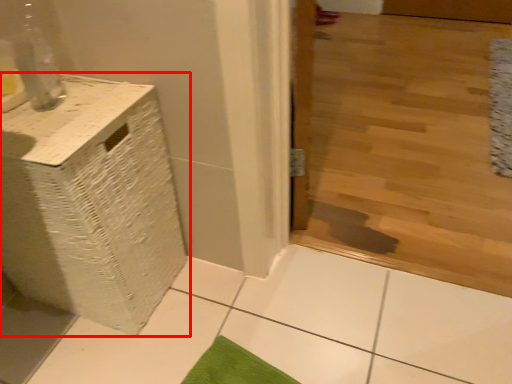
Question: Observing the image, what is the correct spatial positioning of furniture (annotated by the red box) in reference to mat?

Choices:
 (A) left
 (B) right

Answer: (A)